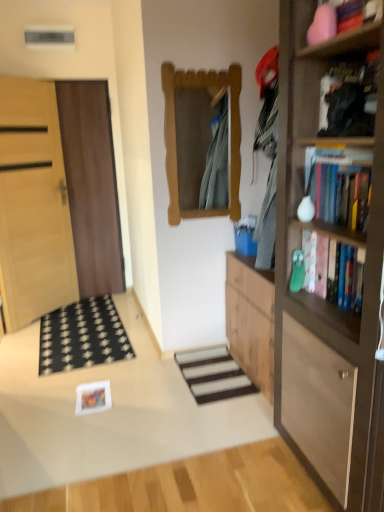
Describe the element at coordinates (213, 374) in the screenshot. The height and width of the screenshot is (512, 384). I see `white striped carpet at center` at that location.

Measure the distance between point (321, 53) and camera.

A distance of 5.52 feet exists between point (321, 53) and camera.

Describe the element at coordinates (82, 336) in the screenshot. I see `black fabric doormat at lower left` at that location.

Image resolution: width=384 pixels, height=512 pixels. Describe the element at coordinates (198, 137) in the screenshot. I see `wooden mirror at center` at that location.

This screenshot has height=512, width=384. Find the location of `wooden bookshelf at upper right`. wooden bookshelf at upper right is located at coordinates (345, 41).

From the image's perspective, is wooden bookshelf at upper right above wooden mirror at center?

Yes, from the image's perspective, wooden bookshelf at upper right is above wooden mirror at center.

Is wooden bookshelf at upper right far away from wooden mirror at center?

Yes, wooden bookshelf at upper right and wooden mirror at center are quite far apart.

Considering the relative sizes of wooden bookshelf at upper right and wooden mirror at center in the image provided, is wooden bookshelf at upper right taller than wooden mirror at center?

In fact, wooden bookshelf at upper right may be shorter than wooden mirror at center.

How much distance is there between black matte bookshelf at upper right, placed as the 3th book when sorted from bottom to top, and hardcover books at right, the second book in the bottom-to-top sequence?

A distance of 7.82 inches exists between black matte bookshelf at upper right, placed as the 3th book when sorted from bottom to top, and hardcover books at right, the second book in the bottom-to-top sequence.

Are black matte bookshelf at upper right, placed as the 3th book when sorted from bottom to top, and hardcover books at right, the second book in the bottom-to-top sequence, located far from each other?

No, black matte bookshelf at upper right, placed as the 3th book when sorted from bottom to top, is in close proximity to hardcover books at right, the second book in the bottom-to-top sequence.

Can hardcover books at right, arranged as the 2th book when viewed from the top, be found inside black matte bookshelf at upper right, marked as the 1th book in a top-to-bottom arrangement?

No, hardcover books at right, arranged as the 2th book when viewed from the top, is not inside black matte bookshelf at upper right, marked as the 1th book in a top-to-bottom arrangement.

What's the angular difference between black matte bookshelf at upper right, placed as the 3th book when sorted from bottom to top, and hardcover books at right, arranged as the 2th book when viewed from the top,'s facing directions?

The angular difference between black matte bookshelf at upper right, placed as the 3th book when sorted from bottom to top, and hardcover books at right, arranged as the 2th book when viewed from the top, is 0.00116 degrees.

Could you tell me if light wood door at left, the first door viewed from the left, is turned towards brown wooden door at left, arranged as the 1th door when viewed from the right?

No, light wood door at left, the first door viewed from the left, does not turn towards brown wooden door at left, arranged as the 1th door when viewed from the right.

Can we say light wood door at left, the first door viewed from the left, lies outside brown wooden door at left, arranged as the 1th door when viewed from the right?

Yes.

From the image's perspective, which object appears higher, light wood door at left, the first door viewed from the left, or brown wooden door at left, the second door in the left-to-right sequence?

From the image's view, brown wooden door at left, the second door in the left-to-right sequence, is above.

Between point (0, 157) and point (112, 211), which one is positioned behind?

The point (112, 211) is more distant.

Can you tell me how much light wood door at left, which is the second door in right-to-left order, and black fabric doormat at lower left differ in facing direction?

light wood door at left, which is the second door in right-to-left order, and black fabric doormat at lower left are facing 41.1 degrees away from each other.

Does point (31, 132) appear closer or farther from the camera than point (78, 321)?

Point (31, 132) is closer to the camera than point (78, 321).

Is light wood door at left, which is the second door in right-to-left order, not close to black fabric doormat at lower left?

light wood door at left, which is the second door in right-to-left order, is actually quite close to black fabric doormat at lower left.

Considering the relative sizes of light wood door at left, which is the second door in right-to-left order, and black fabric doormat at lower left in the image provided, is light wood door at left, which is the second door in right-to-left order, wider than black fabric doormat at lower left?

No, light wood door at left, which is the second door in right-to-left order, is not wider than black fabric doormat at lower left.

Considering the sizes of black matte bookshelf at upper right, marked as the 1th book in a top-to-bottom arrangement, and wooden mirror at center in the image, is black matte bookshelf at upper right, marked as the 1th book in a top-to-bottom arrangement, bigger or smaller than wooden mirror at center?

black matte bookshelf at upper right, marked as the 1th book in a top-to-bottom arrangement, is smaller than wooden mirror at center.

From the image's perspective, which one is positioned higher, black matte bookshelf at upper right, marked as the 1th book in a top-to-bottom arrangement, or wooden mirror at center?

wooden mirror at center appears higher in the image.

Is black matte bookshelf at upper right, marked as the 1th book in a top-to-bottom arrangement, wider than wooden mirror at center?

Indeed, black matte bookshelf at upper right, marked as the 1th book in a top-to-bottom arrangement, has a greater width compared to wooden mirror at center.

Could you tell me if brown wooden door at left, arranged as the 1th door when viewed from the right, is facing wooden mirror at center?

No, brown wooden door at left, arranged as the 1th door when viewed from the right, is not aimed at wooden mirror at center.

From a real-world perspective, is brown wooden door at left, the second door in the left-to-right sequence, above or below wooden mirror at center?

brown wooden door at left, the second door in the left-to-right sequence, is below wooden mirror at center.

Between brown wooden door at left, the second door in the left-to-right sequence, and wooden mirror at center, which one is positioned behind?

brown wooden door at left, the second door in the left-to-right sequence, is further away from the camera.

Is brown wooden door at left, the second door in the left-to-right sequence, positioned far away from wooden mirror at center?

Yes, brown wooden door at left, the second door in the left-to-right sequence, is far from wooden mirror at center.

Which of these two, brown wooden door at left, the second door in the left-to-right sequence, or wooden bookshelf at upper right, stands shorter?

Standing shorter between the two is wooden bookshelf at upper right.

In the scene shown: How much distance is there between brown wooden door at left, arranged as the 1th door when viewed from the right, and wooden bookshelf at upper right?

The distance of brown wooden door at left, arranged as the 1th door when viewed from the right, from wooden bookshelf at upper right is 2.78 meters.

Would you say brown wooden door at left, the second door in the left-to-right sequence, is inside or outside wooden bookshelf at upper right?

The correct answer is: outside.

Is point (102, 165) closer or farther from the camera than point (314, 46)?

Point (102, 165) is positioned farther from the camera compared to point (314, 46).

The height and width of the screenshot is (512, 384). I want to click on mirror on the left of wooden bookshelf at upper right, so click(198, 137).

You are a GUI agent. You are given a task and a screenshot of the screen. Output one action in this format:
    pyautogui.click(x=<x>, y=<y>)
    Task: Click on the book that is the 1st object located below the black matte bookshelf at upper right, marked as the 1th book in a top-to-bottom arrangement (from the image's perspective)
    
    Given the screenshot: What is the action you would take?
    pyautogui.click(x=340, y=186)

When comparing their distances from hardcover books at right, the second book in the bottom-to-top sequence, does wooden mirror at center or wooden bookshelf at upper right seem closer?

wooden bookshelf at upper right lies closer to hardcover books at right, the second book in the bottom-to-top sequence, than the other object.

Considering their positions, is wooden bookshelf at right positioned further to white striped carpet at center than hardcover books at right, arranged as the 2th book when viewed from the top?

The object further to white striped carpet at center is hardcover books at right, arranged as the 2th book when viewed from the top.

Which object lies further to the anchor point hardcover book at right, the 3th book positioned from the top, light wood door at left, which is the second door in right-to-left order, or black matte bookshelf at upper right, placed as the 3th book when sorted from bottom to top?

light wood door at left, which is the second door in right-to-left order, is positioned further to the anchor hardcover book at right, the 3th book positioned from the top.

From the image, which object appears to be nearer to white striped carpet at center, light wood door at left, which is the second door in right-to-left order, or black matte bookshelf at upper right, marked as the 1th book in a top-to-bottom arrangement?

Among the two, black matte bookshelf at upper right, marked as the 1th book in a top-to-bottom arrangement, is located nearer to white striped carpet at center.

Considering their positions, is white striped carpet at center positioned closer to hardcover books at right, the second book in the bottom-to-top sequence, than wooden bookshelf at upper right?

wooden bookshelf at upper right is positioned closer to the anchor hardcover books at right, the second book in the bottom-to-top sequence.

Which object lies nearer to the anchor point hardcover book at right, which is counted as the first book, starting from the bottom, wooden mirror at center or black matte bookshelf at upper right, marked as the 1th book in a top-to-bottom arrangement?

Based on the image, black matte bookshelf at upper right, marked as the 1th book in a top-to-bottom arrangement, appears to be nearer to hardcover book at right, which is counted as the first book, starting from the bottom.

From the picture: Based on their spatial positions, is black matte bookshelf at upper right, marked as the 1th book in a top-to-bottom arrangement, or white striped carpet at center closer to hardcover books at right, arranged as the 2th book when viewed from the top?

black matte bookshelf at upper right, marked as the 1th book in a top-to-bottom arrangement, lies closer to hardcover books at right, arranged as the 2th book when viewed from the top, than the other object.

From the image, which object appears to be nearer to hardcover book at right, the 3th book positioned from the top, light wood door at left, which is the second door in right-to-left order, or wooden bookshelf at upper right?

wooden bookshelf at upper right.

Where is `door between light wood door at left, which is the second door in right-to-left order, and wooden mirror at center, in the horizontal direction`? door between light wood door at left, which is the second door in right-to-left order, and wooden mirror at center, in the horizontal direction is located at coordinates (91, 185).

This screenshot has height=512, width=384. Identify the location of book that lies between black matte bookshelf at upper right, placed as the 3th book when sorted from bottom to top, and wooden bookshelf at right from top to bottom. pyautogui.click(x=340, y=186).

At what (x,y) coordinates should I click in order to perform the action: click on doormat that lies between wooden mirror at center and white striped carpet at center from top to bottom. Please return your answer as a coordinate pair (x, y). The width and height of the screenshot is (384, 512). Looking at the image, I should click on (82, 336).

You are a GUI agent. You are given a task and a screenshot of the screen. Output one action in this format:
    pyautogui.click(x=<x>, y=<y>)
    Task: Click on the mirror between hardcover book at right, the 3th book positioned from the top, and brown wooden door at left, the second door in the left-to-right sequence, along the z-axis
    The image size is (384, 512).
    Given the screenshot: What is the action you would take?
    pyautogui.click(x=198, y=137)